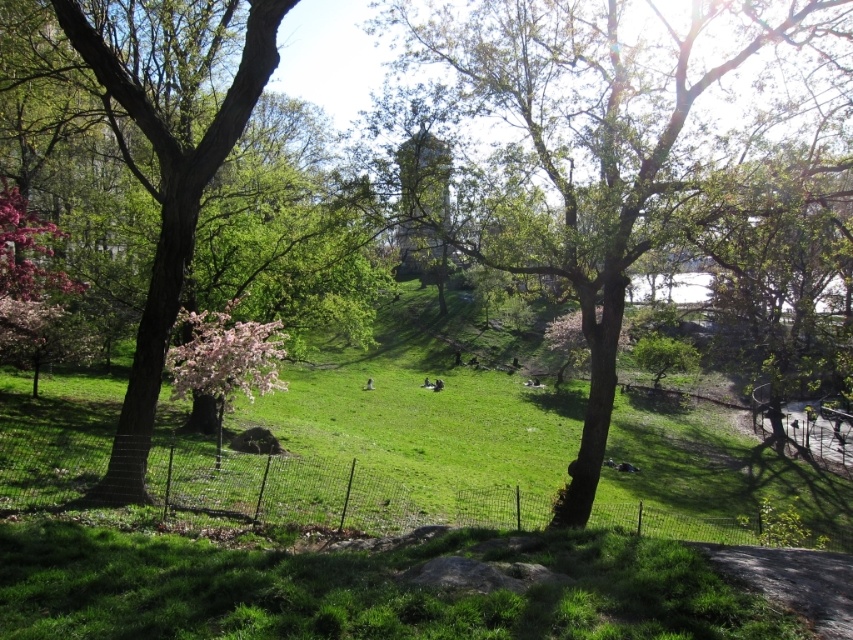
Which is above, green leafy tree at center or smooth brown tree trunk at left?

Positioned higher is green leafy tree at center.

Between point (807, 35) and point (128, 100), which one is positioned behind?

The point (807, 35) is more distant.

This screenshot has height=640, width=853. In order to click on green leafy tree at center in this screenshot , I will do `click(582, 150)`.